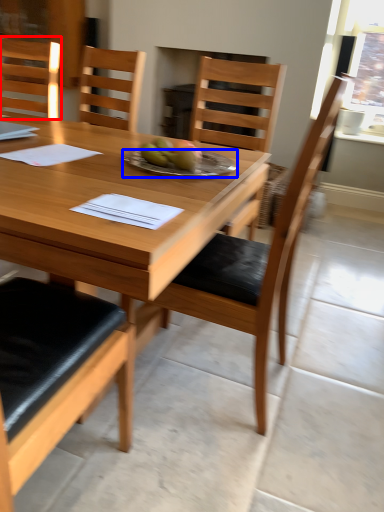
Question: Which object appears closest to the camera in this image, chair (highlighted by a red box) or plate (highlighted by a blue box)?

Choices:
 (A) chair
 (B) plate

Answer: (B)